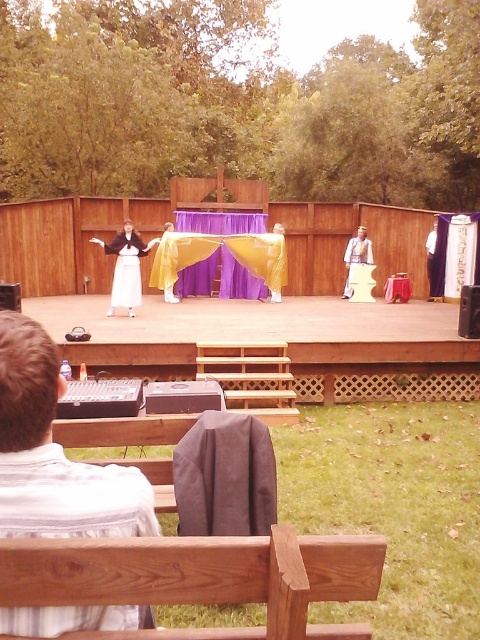
Question: Which point is closer to the camera?

Choices:
 (A) white satin dress at center
 (B) light brown leather jacket at center

Answer: (A)

Question: Is matte black robe at center positioned at the back of light brown leather jacket at center?

Choices:
 (A) yes
 (B) no

Answer: (B)

Question: Which point is farther to the camera?

Choices:
 (A) (355, 262)
 (B) (186, 288)
 (C) (139, 292)
 (D) (120, 232)

Answer: (B)

Question: Does purple velvet curtain at center appear on the left side of light brown leather jacket at center?

Choices:
 (A) yes
 (B) no

Answer: (A)

Question: Is striped cotton shirt at lower left thinner than purple velvet curtain at center?

Choices:
 (A) no
 (B) yes

Answer: (B)

Question: Which of the following is the closest to the observer?

Choices:
 (A) (130, 291)
 (B) (0, 524)
 (C) (354, 240)
 (D) (216, 212)

Answer: (B)